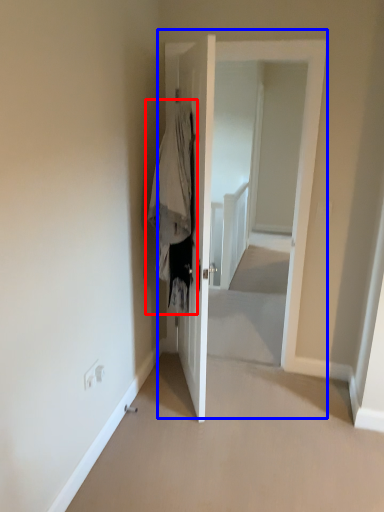
Question: Which object appears closest to the camera in this image, clothing (highlighted by a red box) or door (highlighted by a blue box)?

Choices:
 (A) clothing
 (B) door

Answer: (A)